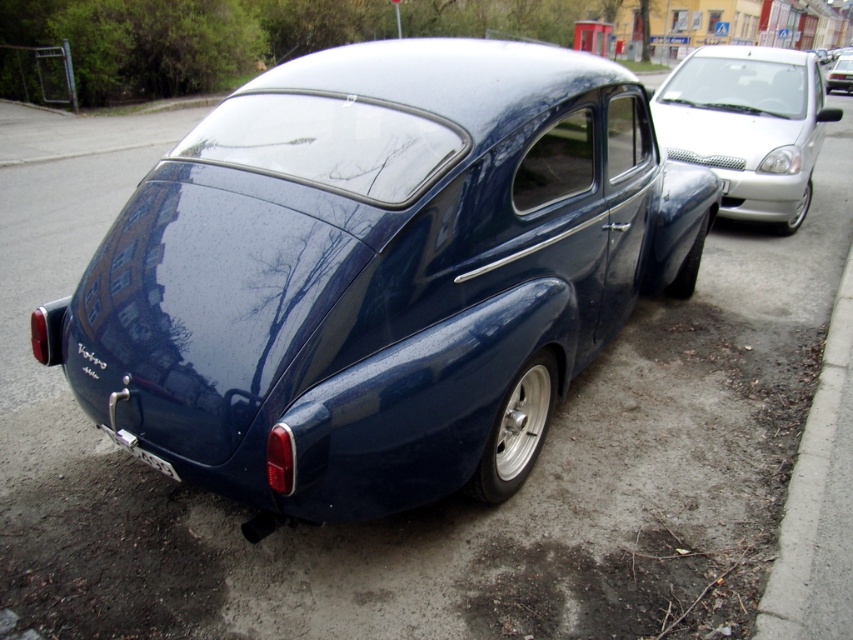
Between glossy blue car at center and glossy metallic car at center, which one appears on the right side from the viewer's perspective?

glossy metallic car at center is more to the right.

Can you confirm if glossy blue car at center is positioned below glossy metallic car at center?

Correct, glossy blue car at center is located below glossy metallic car at center.

The height and width of the screenshot is (640, 853). What do you see at coordinates (380, 273) in the screenshot?
I see `glossy blue car at center` at bounding box center [380, 273].

In order to click on glossy blue car at center in this screenshot , I will do `click(380, 273)`.

Image resolution: width=853 pixels, height=640 pixels. In order to click on glossy blue car at center in this screenshot , I will do `click(380, 273)`.

Can you confirm if glossy blue car at center is bigger than white plastic license plate at lower center?

Correct, glossy blue car at center is larger in size than white plastic license plate at lower center.

This screenshot has height=640, width=853. Find the location of `glossy blue car at center`. glossy blue car at center is located at coordinates (380, 273).

Identify the location of glossy blue car at center. (380, 273).

Does white glossy sedan at right appear on the left side of concrete at lower right?

Incorrect, white glossy sedan at right is not on the left side of concrete at lower right.

Measure the distance between point [657,125] and camera.

The distance of point [657,125] from camera is 7.56 meters.

Where is `white glossy sedan at right`? The height and width of the screenshot is (640, 853). white glossy sedan at right is located at coordinates (747, 125).